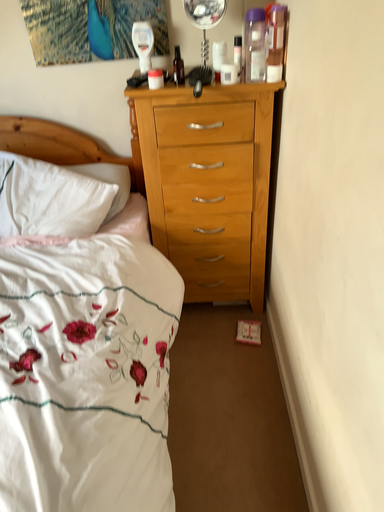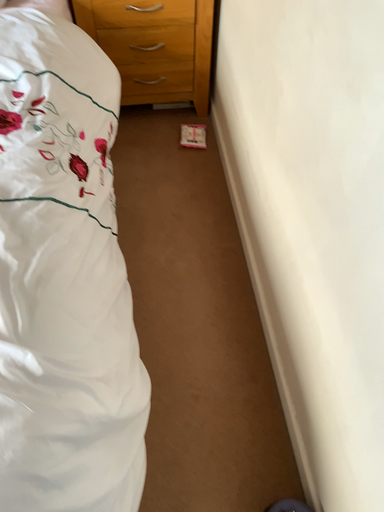
Question: How did the camera likely rotate when shooting the video?

Choices:
 (A) rotated upward
 (B) rotated downward

Answer: (B)